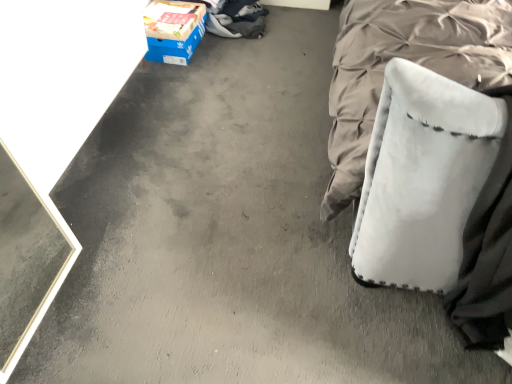
Where is `blank area to the left of white fabric swivel chair at right`? blank area to the left of white fabric swivel chair at right is located at coordinates (305, 275).